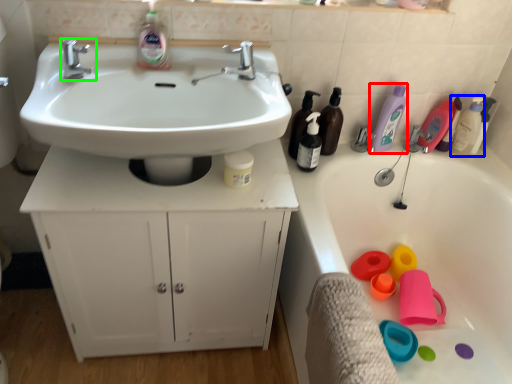
Question: Based on their relative distances, which object is nearer to cleaning product (highlighted by a red box)? Choose from cleaning product (highlighted by a blue box) and tap (highlighted by a green box).

Choices:
 (A) cleaning product
 (B) tap

Answer: (A)